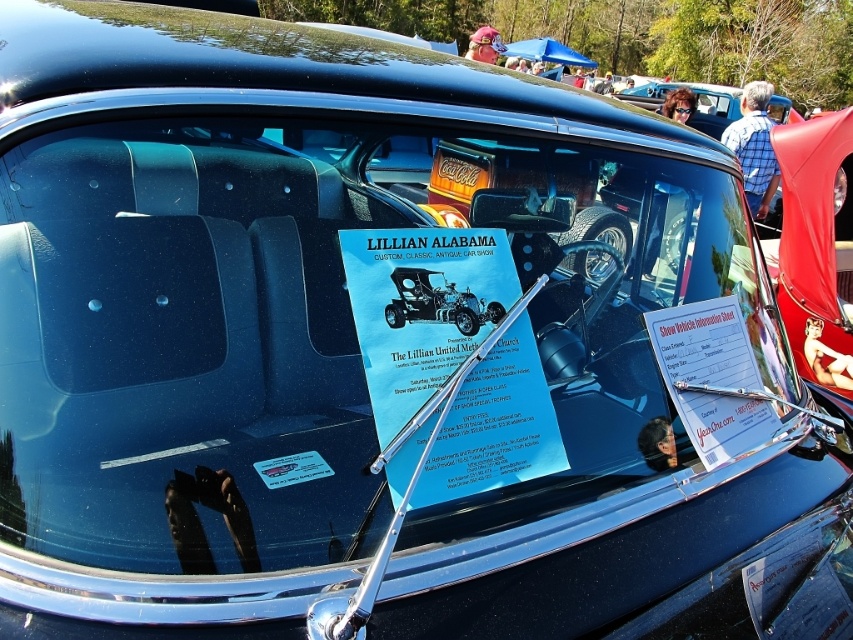
Between point (769, 140) and point (693, 92), which one is positioned in front?

Point (769, 140) is more forward.

Where is `plaid shirt at upper right`? The height and width of the screenshot is (640, 853). plaid shirt at upper right is located at coordinates (753, 147).

Can you confirm if dark hair at center is positioned to the right of smooth brown hair at upper center?

In fact, dark hair at center is to the left of smooth brown hair at upper center.

Who is more distant from viewer, (651, 429) or (683, 120)?

Positioned behind is point (683, 120).

Locate an element on the screen. The width and height of the screenshot is (853, 640). dark hair at center is located at coordinates (657, 444).

Who is positioned more to the right, plaid shirt at upper right or dark hair at center?

Positioned to the right is plaid shirt at upper right.

Can you confirm if plaid shirt at upper right is bigger than dark hair at center?

Yes, plaid shirt at upper right is bigger than dark hair at center.

Does point (732, 140) come farther from viewer compared to point (671, 458)?

That is True.

Identify the location of plaid shirt at upper right. The height and width of the screenshot is (640, 853). (753, 147).